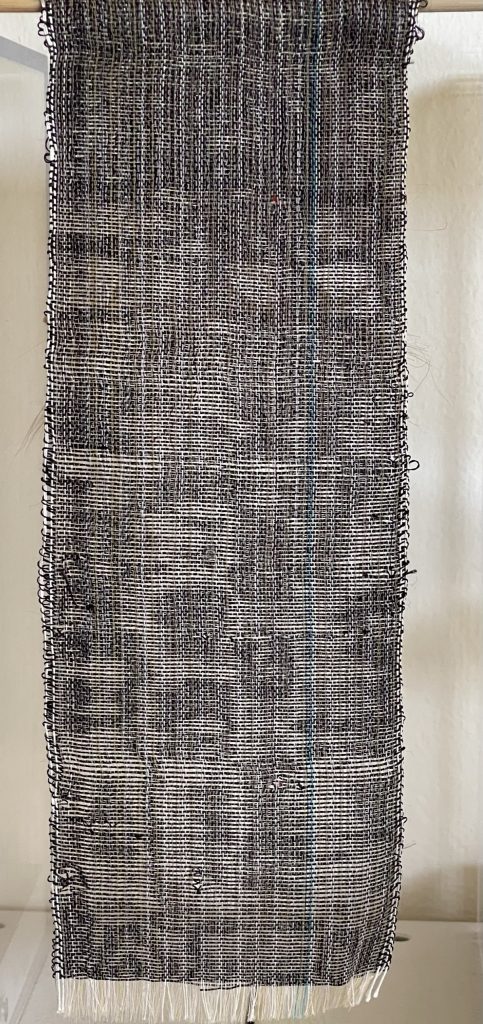
Find the location of a particular element. black cirle patten in tapestry is located at coordinates tap(190, 609).